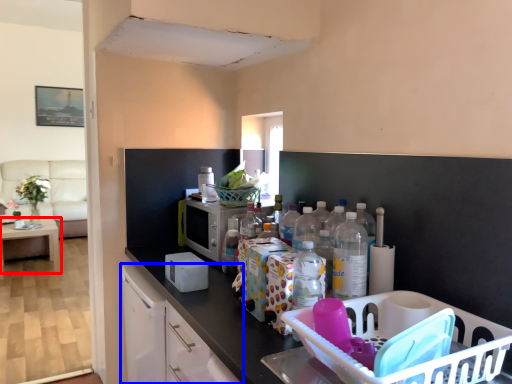
Question: Which object is closer to the camera taking this photo, table (highlighted by a red box) or cabinetry (highlighted by a blue box)?

Choices:
 (A) table
 (B) cabinetry

Answer: (B)